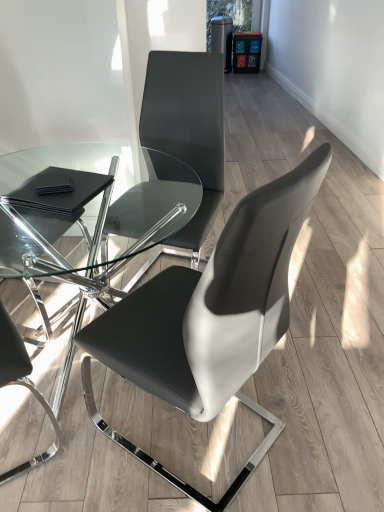
Question: From a real-world perspective, relative to black leather chair at left, which is the first chair from left to right, is black leather pads at lower left vertically above or below?

Choices:
 (A) above
 (B) below

Answer: (A)

Question: Considering the positions of black leather pads at lower left and black leather chair at left, which is the first chair from left to right, in the image, is black leather pads at lower left bigger or smaller than black leather chair at left, which is the first chair from left to right,?

Choices:
 (A) small
 (B) big

Answer: (A)

Question: Considering the real-world distances, which object is closest to the black leather pads at lower left?

Choices:
 (A) matte black chair at center, which is counted as the first chair, starting from the right
 (B) matte black chair at center, which is the 2th chair in left-to-right order
 (C) transparent glass table at center
 (D) black leather chair at left, which is the first chair from left to right

Answer: (D)

Question: Based on their relative distances, which object is farther from the transparent glass table at center?

Choices:
 (A) matte black chair at center, which is the 2th chair in left-to-right order
 (B) black leather chair at left, which is the first chair from left to right
 (C) matte black chair at center, the 3th chair viewed from the left
 (D) black leather pads at lower left

Answer: (C)